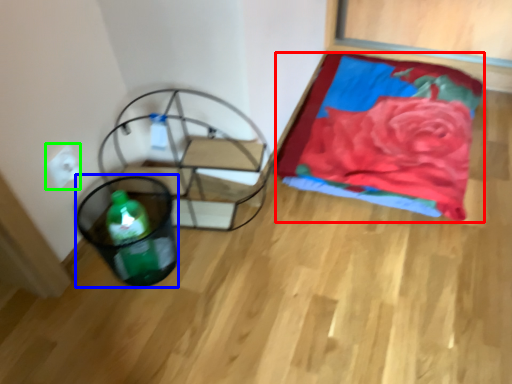
Question: Estimate the real-world distances between objects in this image. Which object is farther from blanket (highlighted by a red box), basket (highlighted by a blue box) or electric outlet (highlighted by a green box)?

Choices:
 (A) basket
 (B) electric outlet

Answer: (B)